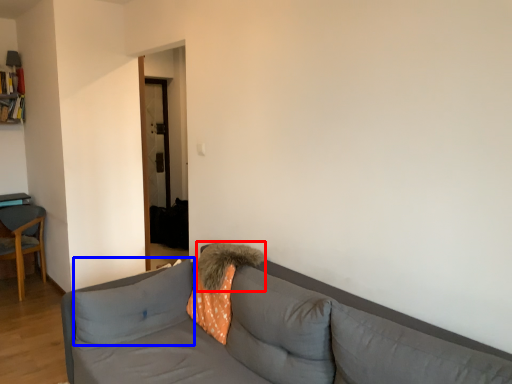
Question: Which object appears closest to the camera in this image, pillow (highlighted by a red box) or pillow (highlighted by a blue box)?

Choices:
 (A) pillow
 (B) pillow

Answer: (B)